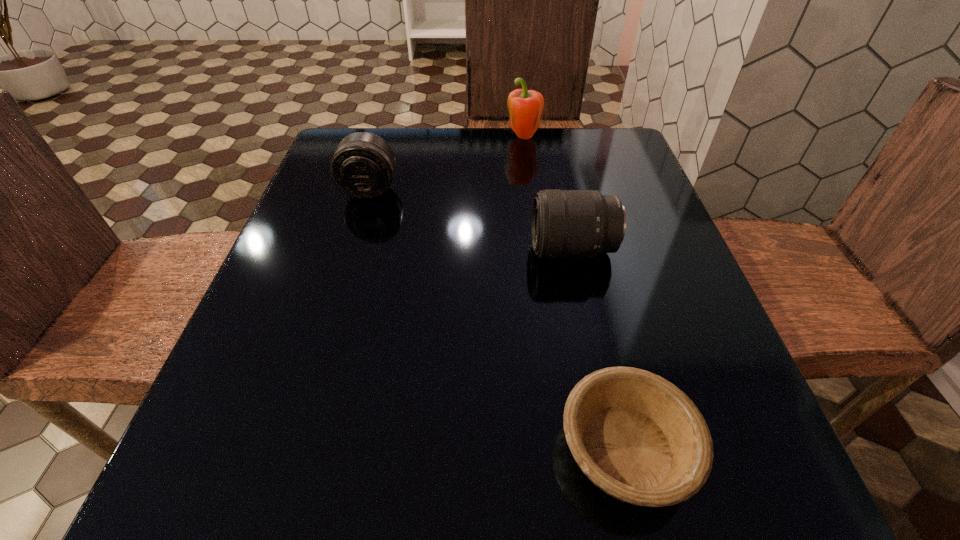
This screenshot has height=540, width=960. What are the coordinates of `vacant space located 0.120m on the surface of the right telephoto lens` in the screenshot? It's located at (468, 249).

At what (x,y) coordinates should I click in order to perform the action: click on blank space located on the surface of the right telephoto lens. Please return your answer as a coordinate pair (x, y). Looking at the image, I should click on (342, 249).

Where is `blank space located on the surface of the right telephoto lens`? blank space located on the surface of the right telephoto lens is located at coordinates (347, 249).

Find the location of a particular element. This screenshot has width=960, height=540. vacant area located on the back of the nearest object is located at coordinates 575,230.

I want to click on pepper located at the far edge, so click(525, 106).

The height and width of the screenshot is (540, 960). I want to click on telephoto lens located in the far edge section of the desktop, so click(363, 165).

This screenshot has width=960, height=540. What are the coordinates of `object that is positioned at the near edge` in the screenshot? It's located at (639, 438).

Identify the location of object that is at the left edge. (363, 165).

Identify the location of telephoto lens that is at the right edge. The image size is (960, 540). tap(565, 223).

I want to click on bowl positioned at the right edge, so click(639, 438).